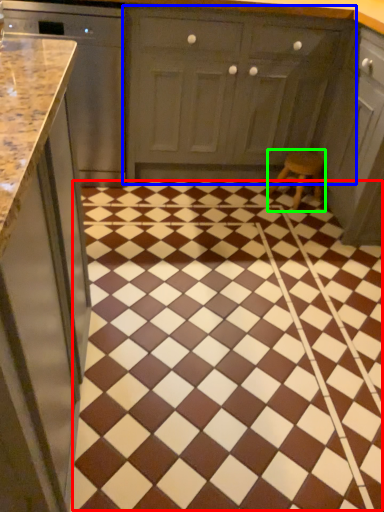
Question: Estimate the real-world distances between objects in this image. Which object is closer to ceramic tile (highlighted by a red box), cabinetry (highlighted by a blue box) or stool (highlighted by a green box)?

Choices:
 (A) cabinetry
 (B) stool

Answer: (B)